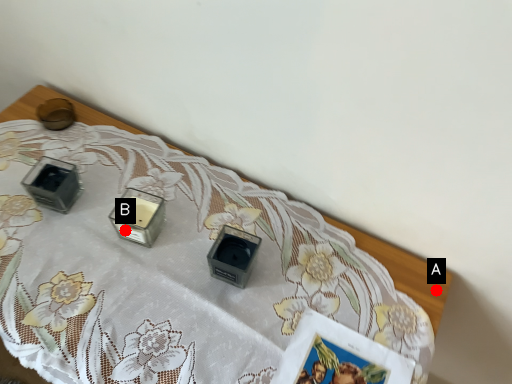
Question: Two points are circled on the image, labeled by A and B beside each circle. Which point is closer to the camera?

Choices:
 (A) A is closer
 (B) B is closer

Answer: (A)